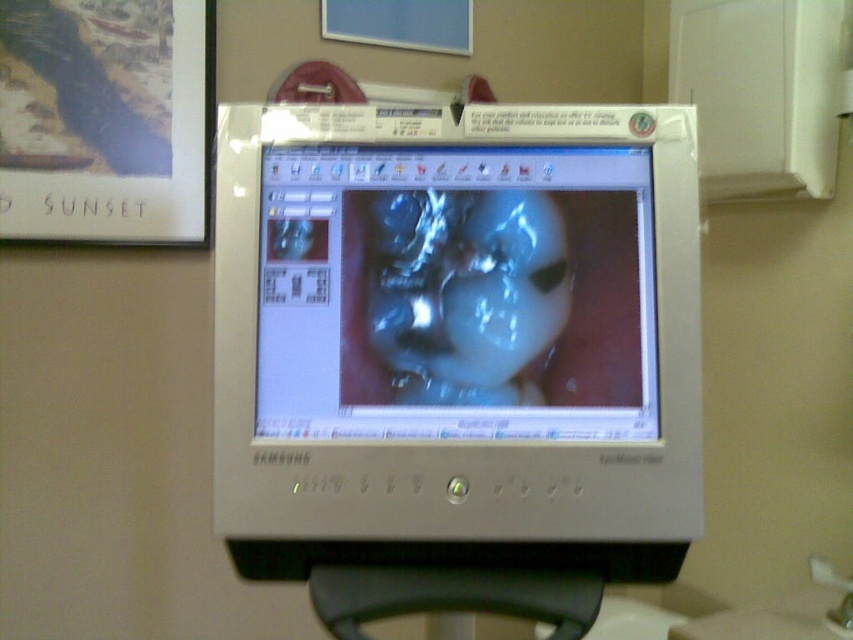
You are a medical technician preparing to adjust the settings on the monitor. You need to reach both the silver metallic monitor at center and the translucent plastic face at center. Which object should you move first to avoid obstructing your view of the other?

You should move the translucent plastic face at center first because the silver metallic monitor at center is positioned on its right side, meaning the monitor is to the right of the plastic face. By adjusting the plastic face first, you can ensure it doesn not block access to the monitor which is already offset to the right.

From the picture: You are a medical technician who needs to adjust the focus of the monitor. The focus knob is located on the side of the monitor. If you are standing 32.67 inches away from the shiny metallic monitor at center, can you comfortably reach the knob without moving closer?

The shiny metallic monitor at center is 32.67 inches away from the viewer. Since the average comfortable reaching distance for most adults is typically around 28 to 30 inches, you may need to move slightly closer to comfortably adjust the focus knob without straining.